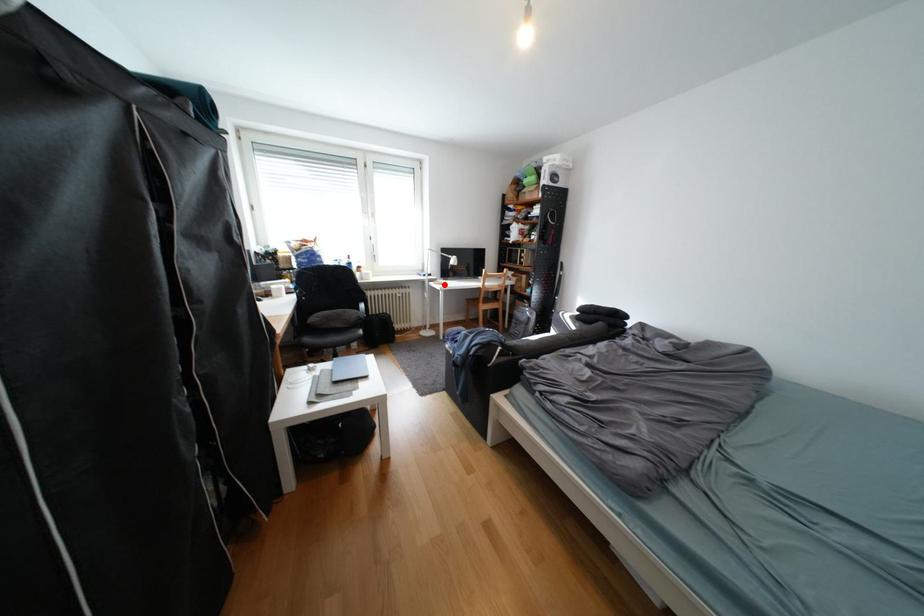
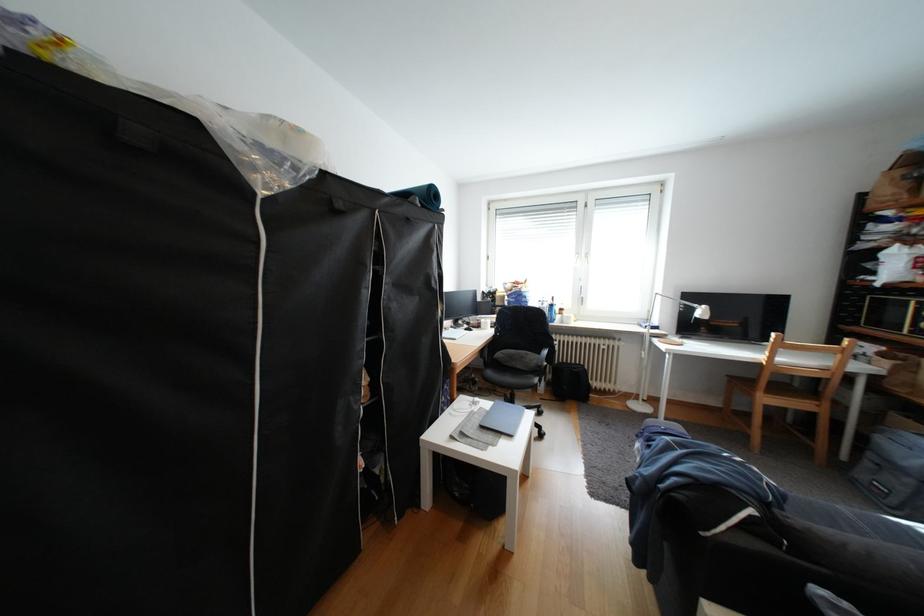
The point at the highlighted location is marked in the first image. Where is the corresponding point in the second image?

(667, 341)